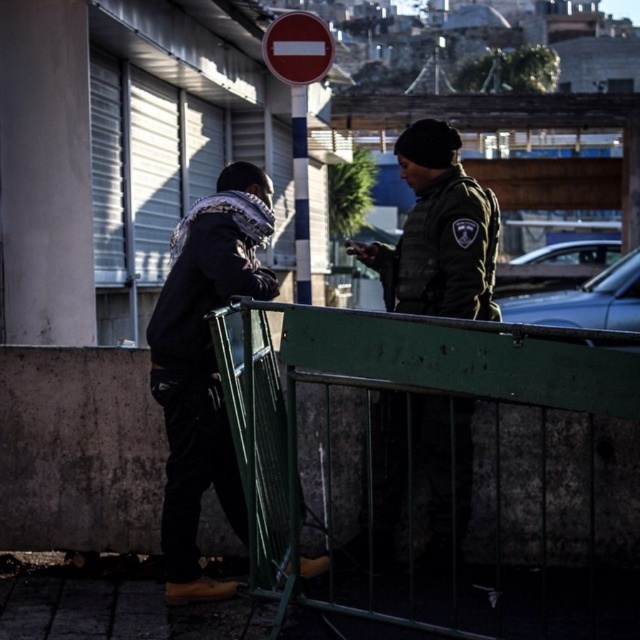
You are a delivery person who needs to place a package on the red matte sign at upper center. You are currently standing next to the green matte uniform at center. Can you reach the sign without moving your feet?

The distance between the green matte uniform at center and the red matte sign at upper center is 4.52 meters, so you cannot reach the sign without moving your feet as the distance is too far.

You are standing at the center of the image and want to locate the green metal fence at center. Based on the coordinates provided, in which direction should you look to find it?

The green metal fence at center is located at coordinates point (x=449, y=467), so you should look towards the lower right direction from the center to find it.

You are a pedestrian standing behind the green metal railing in the scene. You need to determine which object, the green matte uniform at center or the red matte sign at upper center, is taller. Based on the scene description, which one is taller?

The green matte uniform at center is much taller than the red matte sign at upper center according to the description.